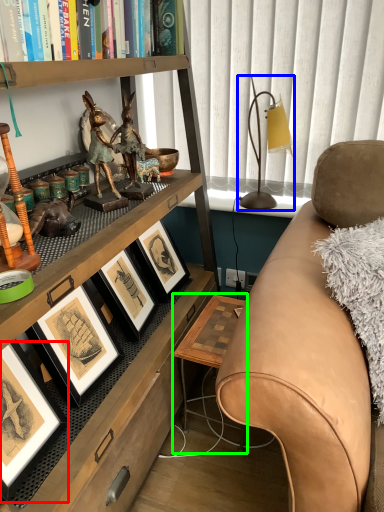
Question: Which is farther away from picture frame (highlighted by a red box)? table lamp (highlighted by a blue box) or table (highlighted by a green box)?

Choices:
 (A) table lamp
 (B) table

Answer: (A)